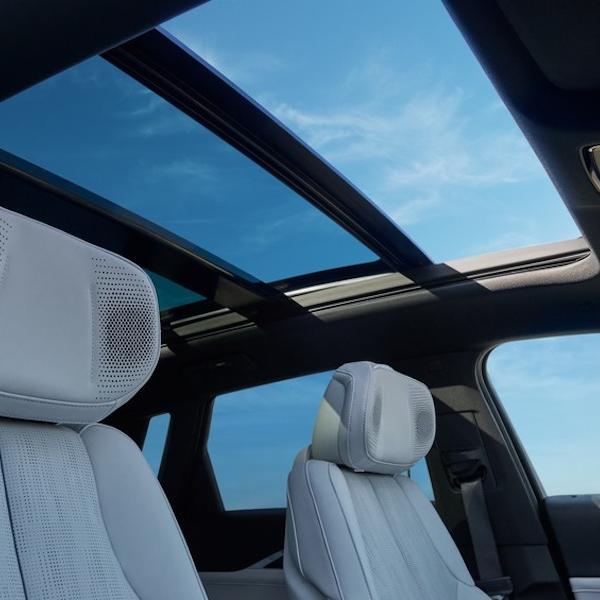
The width and height of the screenshot is (600, 600). I want to click on speakers, so click(x=127, y=320).